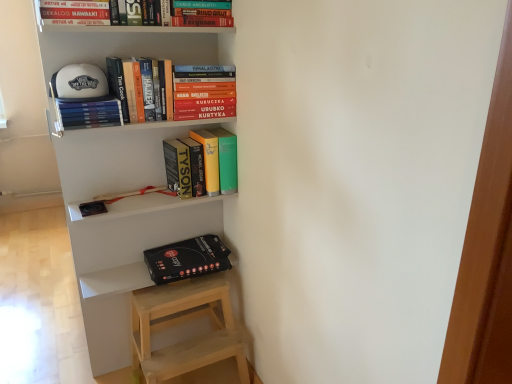
What do you see at coordinates (187, 259) in the screenshot?
I see `black matte box at lower left` at bounding box center [187, 259].

The width and height of the screenshot is (512, 384). I want to click on white matte bookshelf at upper center, so click(123, 223).

Locate an element on the screen. The image size is (512, 384). hardcover books at upper center, which is the third book from top to bottom is located at coordinates (204, 91).

The height and width of the screenshot is (384, 512). What do you see at coordinates (70, 11) in the screenshot?
I see `hardcover book at upper center, which is the 5th book in bottom-to-top order` at bounding box center [70, 11].

At what (x,y) coordinates should I click in order to perform the action: click on hardcover books at upper left, which is the fourth book from top to bottom. Please return your answer as a coordinate pair (x, y). Image resolution: width=512 pixels, height=384 pixels. Looking at the image, I should click on (89, 113).

From the picture: From the image's perspective, would you say hardcover books at upper left, which is the fourth book from top to bottom, is positioned over white matte bookshelf at upper center?

Yes.

Is hardcover books at upper left, which is the fourth book from top to bottom, far from white matte bookshelf at upper center?

That's not correct — hardcover books at upper left, which is the fourth book from top to bottom, is a little close to white matte bookshelf at upper center.

Considering the points (81, 120) and (109, 165), which point is in front, point (81, 120) or point (109, 165)?

The point (81, 120) is more forward.

Does hardcover books at upper left, which is the fourth book from top to bottom, turn towards white matte bookshelf at upper center?

Yes.

Is hardcover books at upper left, which is the fourth book from bottom to top, at the right side of hardcover books at upper center, which appears as the third book when ordered from the bottom?

In fact, hardcover books at upper left, which is the fourth book from bottom to top, is to the left of hardcover books at upper center, which appears as the third book when ordered from the bottom.

Can you tell me how much hardcover books at upper left, which is the fourth book from bottom to top, and hardcover books at upper center, which is the third book from top to bottom, differ in facing direction?

3.23 degrees.

Identify the location of book that is the 1st one below the hardcover books at upper left, arranged as the 2th book when viewed from the top (from a real-world perspective). The width and height of the screenshot is (512, 384). (204, 91).

How much distance is there between white matte bookshelf at upper center and black matte box at lower left?

white matte bookshelf at upper center is 8.31 inches from black matte box at lower left.

Between point (70, 235) and point (205, 241), which one is positioned behind?

The point (205, 241) is more distant.

From their relative heights in the image, would you say white matte bookshelf at upper center is taller or shorter than black matte box at lower left?

Considering their sizes, white matte bookshelf at upper center has more height than black matte box at lower left.

Is white matte bookshelf at upper center not close to black matte box at lower left?

No, there isn't a large distance between white matte bookshelf at upper center and black matte box at lower left.

How different are the orientations of hardcover books at upper center, which is the third book from top to bottom, and hardcover books at upper left, arranged as the 2th book when viewed from the top, in degrees?

They differ by 3.23 degrees in their facing directions.

Looking at this image, between hardcover books at upper center, which appears as the third book when ordered from the bottom, and hardcover books at upper left, which is the fourth book from bottom to top, which one has more height?

With more height is hardcover books at upper left, which is the fourth book from bottom to top.

Is hardcover books at upper left, which is the fourth book from bottom to top, surrounded by hardcover books at upper center, which is the third book from top to bottom?

No, hardcover books at upper center, which is the third book from top to bottom, does not contain hardcover books at upper left, which is the fourth book from bottom to top.

This screenshot has height=384, width=512. I want to click on book that is the 1st one when counting downward from the hardcover books at upper left, arranged as the 2th book when viewed from the top (from the image's perspective), so click(x=204, y=91).

Consider the image. From the image's perspective, is white matte bookshelf at upper center positioned above or below hardcover books at upper left, arranged as the 2th book when viewed from the top?

Clearly, from the image's perspective, white matte bookshelf at upper center is below hardcover books at upper left, arranged as the 2th book when viewed from the top.

Considering the sizes of white matte bookshelf at upper center and hardcover books at upper left, arranged as the 2th book when viewed from the top, in the image, is white matte bookshelf at upper center taller or shorter than hardcover books at upper left, arranged as the 2th book when viewed from the top,?

Considering their sizes, white matte bookshelf at upper center has more height than hardcover books at upper left, arranged as the 2th book when viewed from the top.

Is hardcover books at upper left, which is the fourth book from bottom to top, located within white matte bookshelf at upper center?

Absolutely, hardcover books at upper left, which is the fourth book from bottom to top, is inside white matte bookshelf at upper center.

Between white matte bookshelf at upper center and hardcover books at upper left, which is the fourth book from bottom to top, which one has smaller size?

hardcover books at upper left, which is the fourth book from bottom to top, is smaller.

Identify the location of book that appears in front of the hardcover books at upper left, which is the fourth book from top to bottom. The height and width of the screenshot is (384, 512). (70, 11).

Between hardcover book at upper center, the first book in the top-to-bottom sequence, and hardcover books at upper left, which is counted as the second book, starting from the bottom, which one has larger size?

Bigger between the two is hardcover book at upper center, the first book in the top-to-bottom sequence.

Is hardcover books at upper left, which is counted as the second book, starting from the bottom, completely or partially inside hardcover book at upper center, the first book in the top-to-bottom sequence?

No, hardcover books at upper left, which is counted as the second book, starting from the bottom, is not inside hardcover book at upper center, the first book in the top-to-bottom sequence.

Based on the photo, which is correct: black matte box at lower left is inside hardcover books at upper left, which is the fourth book from top to bottom, or outside of it?

black matte box at lower left is not inside hardcover books at upper left, which is the fourth book from top to bottom, it's outside.

Is black matte box at lower left far from hardcover books at upper left, which is counted as the second book, starting from the bottom?

black matte box at lower left is actually quite close to hardcover books at upper left, which is counted as the second book, starting from the bottom.

From a real-world perspective, is black matte box at lower left below hardcover books at upper left, which is counted as the second book, starting from the bottom?

Yes, from a real-world perspective, black matte box at lower left is beneath hardcover books at upper left, which is counted as the second book, starting from the bottom.

Considering the sizes of black matte box at lower left and hardcover books at upper left, which is the fourth book from top to bottom, in the image, is black matte box at lower left bigger or smaller than hardcover books at upper left, which is the fourth book from top to bottom,?

Considering their sizes, black matte box at lower left takes up more space than hardcover books at upper left, which is the fourth book from top to bottom.

From the image's perspective, count 2nd books upward from the white matte bookshelf at upper center and point to it. Please provide its 2D coordinates.

[(89, 113)]

From a real-world perspective, starting from the hardcover books at upper left, arranged as the 2th book when viewed from the top, which book is the 1st one below it? Please provide its 2D coordinates.

[(204, 91)]

Which object lies nearer to the anchor point hardcover books at upper left, arranged as the 2th book when viewed from the top, matte yellow book at center, the 1th book from the bottom, or black matte box at lower left?

matte yellow book at center, the 1th book from the bottom, lies closer to hardcover books at upper left, arranged as the 2th book when viewed from the top, than the other object.

Which object lies nearer to the anchor point hardcover books at upper left, which is counted as the second book, starting from the bottom, hardcover books at upper center, which appears as the third book when ordered from the bottom, or hardcover books at upper left, arranged as the 2th book when viewed from the top?

hardcover books at upper left, arranged as the 2th book when viewed from the top.

Which object lies nearer to the anchor point matte yellow book at center, the 1th book from the bottom, hardcover books at upper left, which is counted as the second book, starting from the bottom, or hardcover book at upper center, which is the 5th book in bottom-to-top order?

hardcover books at upper left, which is counted as the second book, starting from the bottom, lies closer to matte yellow book at center, the 1th book from the bottom, than the other object.

Which object lies nearer to the anchor point hardcover books at upper left, which is the fourth book from bottom to top, white matte bookshelf at upper center or hardcover books at upper center, which appears as the third book when ordered from the bottom?

hardcover books at upper center, which appears as the third book when ordered from the bottom, is closer to hardcover books at upper left, which is the fourth book from bottom to top.

Looking at the image, which one is located closer to hardcover book at upper center, the first book in the top-to-bottom sequence, hardcover books at upper left, which is counted as the second book, starting from the bottom, or hardcover books at upper center, which is the third book from top to bottom?

Based on the image, hardcover books at upper center, which is the third book from top to bottom, appears to be nearer to hardcover book at upper center, the first book in the top-to-bottom sequence.

Which object lies further to the anchor point hardcover book at upper center, the first book in the top-to-bottom sequence, hardcover books at upper center, which is the third book from top to bottom, or matte yellow book at center, the 5th book in the top-to-bottom sequence?

matte yellow book at center, the 5th book in the top-to-bottom sequence.

When comparing their distances from matte yellow book at center, the 1th book from the bottom, does hardcover books at upper center, which is the third book from top to bottom, or hardcover books at upper left, which is the fourth book from bottom to top, seem further?

The object further to matte yellow book at center, the 1th book from the bottom, is hardcover books at upper left, which is the fourth book from bottom to top.

Looking at the image, which one is located closer to hardcover book at upper center, which is the 5th book in bottom-to-top order, matte yellow book at center, the 5th book in the top-to-bottom sequence, or hardcover books at upper left, arranged as the 2th book when viewed from the top?

The object closer to hardcover book at upper center, which is the 5th book in bottom-to-top order, is hardcover books at upper left, arranged as the 2th book when viewed from the top.

Where is `book between hardcover book at upper center, the first book in the top-to-bottom sequence, and hardcover books at upper center, which appears as the third book when ordered from the bottom, in the vertical direction`? The width and height of the screenshot is (512, 384). book between hardcover book at upper center, the first book in the top-to-bottom sequence, and hardcover books at upper center, which appears as the third book when ordered from the bottom, in the vertical direction is located at coordinates (132, 87).

Where is `shelf between hardcover book at upper center, which is the 5th book in bottom-to-top order, and black matte box at lower left vertically`? This screenshot has height=384, width=512. shelf between hardcover book at upper center, which is the 5th book in bottom-to-top order, and black matte box at lower left vertically is located at coordinates (123, 223).

The width and height of the screenshot is (512, 384). I want to click on book between hardcover books at upper left, which is counted as the second book, starting from the bottom, and black matte box at lower left, in the vertical direction, so click(x=218, y=159).

Image resolution: width=512 pixels, height=384 pixels. In order to click on shelf that lies between hardcover books at upper left, which is counted as the second book, starting from the bottom, and black matte box at lower left from top to bottom in this screenshot , I will do `click(123, 223)`.